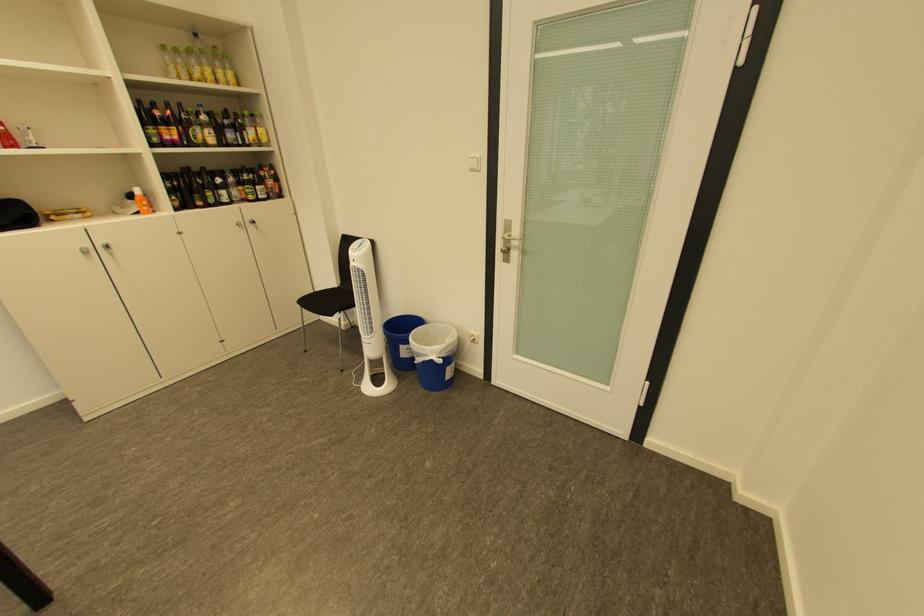
The width and height of the screenshot is (924, 616). What do you see at coordinates (506, 246) in the screenshot?
I see `the silver door handle` at bounding box center [506, 246].